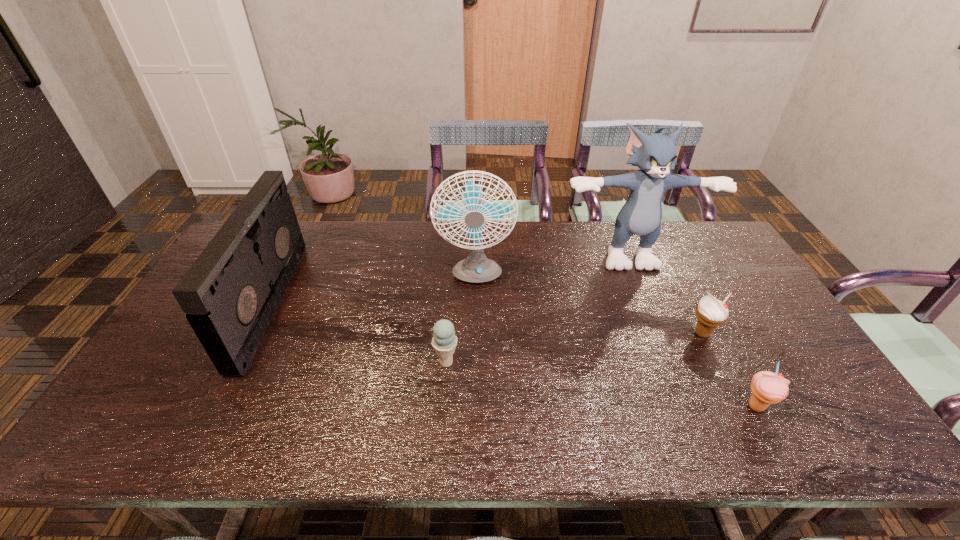
Image resolution: width=960 pixels, height=540 pixels. In order to click on cat in this screenshot , I will do `click(655, 155)`.

You are a GUI agent. You are given a task and a screenshot of the screen. Output one action in this format:
    pyautogui.click(x=<x>, y=<y>)
    Task: Click on the fan
    This screenshot has height=540, width=960.
    Given the screenshot: What is the action you would take?
    point(476,268)

Where is `the leftmost object`? This screenshot has width=960, height=540. the leftmost object is located at coordinates (230, 293).

The image size is (960, 540). What are the coordinates of `videotape` in the screenshot? It's located at (230, 293).

At what (x,y) coordinates should I click in order to perform the action: click on the second farthest icecream. Please return your answer as a coordinate pair (x, y). This screenshot has width=960, height=540. Looking at the image, I should click on (444, 341).

Identify the location of the farthest icecream. This screenshot has width=960, height=540. (x=711, y=313).

Where is `the nearest object`? the nearest object is located at coordinates (768, 388).

You are a GUI agent. You are given a task and a screenshot of the screen. Output one action in this format:
    pyautogui.click(x=<x>, y=<y>)
    Task: Click on the vacant point located 0.130m on the front-facing side of the cat
    This screenshot has height=540, width=960.
    Given the screenshot: What is the action you would take?
    pyautogui.click(x=646, y=301)

I want to click on free space located on the front-facing side of the fan, so click(474, 324).

I want to click on blank area located on the front side of the third tallest object, so click(x=333, y=303).